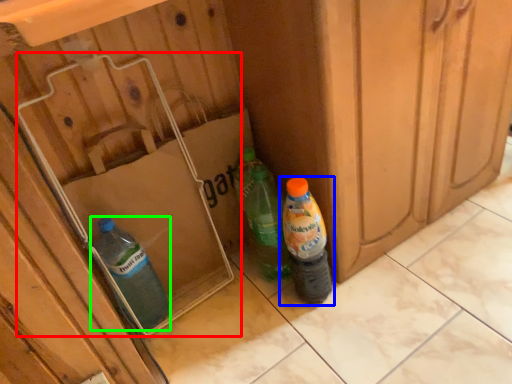
Question: Considering the real-world distances, which object is farthest from cardboard box (highlighted by a red box)? bottle (highlighted by a blue box) or bottle (highlighted by a green box)?

Choices:
 (A) bottle
 (B) bottle

Answer: (A)